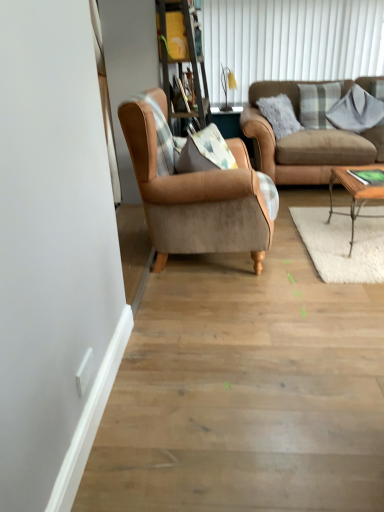
In order to face suede brown armchair at center, should I rotate leftwards or rightwards?

You should rotate right by 2.351 degrees.

In order to click on suede brown armchair at center in this screenshot , I will do coord(196,198).

Measure the distance between point (226, 71) and camera.

The depth of point (226, 71) is 4.35 meters.

Locate an element on the screen. matte yellow lampshade at upper center is located at coordinates (227, 85).

The image size is (384, 512). What do you see at coordinates (317, 103) in the screenshot?
I see `plaid fabric pillow at upper right, acting as the first pillow starting from the left` at bounding box center [317, 103].

This screenshot has height=512, width=384. In order to click on white textured shutter at upper center in this screenshot , I will do `click(290, 41)`.

Identify the location of suede brown armchair at center. This screenshot has height=512, width=384. (196, 198).

Can woodenwoodencoffee table at right be found inside wooden bookshelf at upper center?

No, woodenwoodencoffee table at right is not surrounded by wooden bookshelf at upper center.

From a real-world perspective, is wooden bookshelf at upper center positioned under woodenwoodencoffee table at right based on gravity?

Actually, wooden bookshelf at upper center is physically above woodenwoodencoffee table at right in the real world.

Does wooden bookshelf at upper center have a lesser height compared to woodenwoodencoffee table at right?

No.

Considering their positions, is white plastic power outlet at lower left located in front of or behind wooden bookshelf at upper center?

In the image, white plastic power outlet at lower left appears in front of wooden bookshelf at upper center.

From the image's perspective, is white plastic power outlet at lower left beneath wooden bookshelf at upper center?

Yes, from the image's perspective, white plastic power outlet at lower left is below wooden bookshelf at upper center.

What's the angular difference between white plastic power outlet at lower left and wooden bookshelf at upper center's facing directions?

0.296 degrees separate the facing orientations of white plastic power outlet at lower left and wooden bookshelf at upper center.

Considering the relative sizes of white plastic power outlet at lower left and wooden bookshelf at upper center in the image provided, is white plastic power outlet at lower left wider than wooden bookshelf at upper center?

No, white plastic power outlet at lower left is not wider than wooden bookshelf at upper center.

Considering the positions of point (344, 108) and point (305, 52), is point (344, 108) closer or farther from the camera than point (305, 52)?

Point (344, 108) is closer to the camera than point (305, 52).

Based on their sizes in the image, would you say gray cotton pillow at upper right, the first pillow from the right, is bigger or smaller than white textured shutter at upper center?

In the image, gray cotton pillow at upper right, the first pillow from the right, appears to be smaller than white textured shutter at upper center.

Could you tell me if gray cotton pillow at upper right, which is the 2th pillow from left to right, is turned towards white textured shutter at upper center?

No, gray cotton pillow at upper right, which is the 2th pillow from left to right, is not oriented towards white textured shutter at upper center.

Who is shorter, gray cotton pillow at upper right, which is the 2th pillow from left to right, or white textured shutter at upper center?

gray cotton pillow at upper right, which is the 2th pillow from left to right.

Between wooden bookshelf at upper center and suede brown armchair at center, which one has smaller width?

Thinner between the two is wooden bookshelf at upper center.

Which is nearer, [201,90] or [208,177]?

Clearly, point [201,90] is more distant from the camera than point [208,177].

Is wooden bookshelf at upper center positioned with its back to suede brown armchair at center?

No.

Is white plastic power outlet at lower left taller than gray cotton pillow at upper right, which is the 2th pillow from left to right?

No.

Starting from the white plastic power outlet at lower left, which pillow is the 2nd one to the right? Please provide its 2D coordinates.

[(356, 111)]

From a real-world perspective, who is located higher, white plastic power outlet at lower left or gray cotton pillow at upper right, the first pillow from the right?

gray cotton pillow at upper right, the first pillow from the right, is physically above.

Is white plastic power outlet at lower left oriented towards gray cotton pillow at upper right, the first pillow from the right?

No.

How far apart are gray cotton pillow at upper right, the first pillow from the right, and brown leather couch at upper right?

gray cotton pillow at upper right, the first pillow from the right, and brown leather couch at upper right are 16.49 inches apart from each other.

In the scene shown: From a real-world perspective, which object rests below the other?

brown leather couch at upper right is physically lower.

Can you confirm if gray cotton pillow at upper right, the first pillow from the right, is wider than brown leather couch at upper right?

Incorrect, the width of gray cotton pillow at upper right, the first pillow from the right, does not surpass that of brown leather couch at upper right.

Is gray cotton pillow at upper right, which is the 2th pillow from left to right, inside or outside of brown leather couch at upper right?

gray cotton pillow at upper right, which is the 2th pillow from left to right, is inside brown leather couch at upper right.

Looking at the image, does gray cotton pillow at upper right, which is the 2th pillow from left to right, seem bigger or smaller compared to suede brown armchair at center?

Considering their sizes, gray cotton pillow at upper right, which is the 2th pillow from left to right, takes up less space than suede brown armchair at center.

Is suede brown armchair at center inside gray cotton pillow at upper right, the first pillow from the right?

Actually, suede brown armchair at center is outside gray cotton pillow at upper right, the first pillow from the right.

Can you confirm if gray cotton pillow at upper right, which is the 2th pillow from left to right, is wider than suede brown armchair at center?

No, gray cotton pillow at upper right, which is the 2th pillow from left to right, is not wider than suede brown armchair at center.

Can you confirm if gray cotton pillow at upper right, the first pillow from the right, is positioned to the left of suede brown armchair at center?

Incorrect, gray cotton pillow at upper right, the first pillow from the right, is not on the left side of suede brown armchair at center.

Locate an element on the screen. This screenshot has height=512, width=384. bookshelf above the woodenwoodencoffee table at right (from a real-world perspective) is located at coordinates (182, 54).

The height and width of the screenshot is (512, 384). What are the coordinates of `power outlet below the wooden bookshelf at upper center (from the image's perspective)` in the screenshot? It's located at (84, 372).

Estimate the real-world distances between objects in this image. Which object is further from suede brown armchair at center, wooden bookshelf at upper center or gray cotton pillow at upper right, the first pillow from the right?

Based on the image, gray cotton pillow at upper right, the first pillow from the right, appears to be further to suede brown armchair at center.

When comparing their distances from white plastic power outlet at lower left, does gray cotton pillow at upper right, which is the 2th pillow from left to right, or suede brown armchair at center seem closer?

suede brown armchair at center is closer to white plastic power outlet at lower left.

Estimate the real-world distances between objects in this image. Which object is closer to woodenwoodencoffee table at right, matte yellow lampshade at upper center or gray cotton pillow at upper right, the first pillow from the right?

gray cotton pillow at upper right, the first pillow from the right, lies closer to woodenwoodencoffee table at right than the other object.

Based on their spatial positions, is suede brown armchair at center or gray cotton pillow at upper right, the first pillow from the right, further from plaid fabric pillow at upper right, which is the second pillow in right-to-left order?

Based on the image, suede brown armchair at center appears to be further to plaid fabric pillow at upper right, which is the second pillow in right-to-left order.

Looking at the image, which one is located further to white textured shutter at upper center, woodenwoodencoffee table at right or brown leather couch at upper right?

woodenwoodencoffee table at right is positioned further to the anchor white textured shutter at upper center.

From the picture: Considering their positions, is suede brown armchair at center positioned closer to matte yellow lampshade at upper center than gray cotton pillow at upper right, the first pillow from the right?

gray cotton pillow at upper right, the first pillow from the right.

Which object lies nearer to the anchor point plaid fabric pillow at upper right, acting as the first pillow starting from the left, wooden bookshelf at upper center or matte yellow lampshade at upper center?

Based on the image, matte yellow lampshade at upper center appears to be nearer to plaid fabric pillow at upper right, acting as the first pillow starting from the left.

Which object lies nearer to the anchor point white plastic power outlet at lower left, white textured shutter at upper center or matte yellow lampshade at upper center?

Based on the image, matte yellow lampshade at upper center appears to be nearer to white plastic power outlet at lower left.

What are the coordinates of `coffee table between suede brown armchair at center and matte yellow lampshade at upper center from front to back` in the screenshot? It's located at (357, 189).

This screenshot has height=512, width=384. In order to click on shutter situated between matte yellow lampshade at upper center and gray cotton pillow at upper right, which is the 2th pillow from left to right, from left to right in this screenshot , I will do (x=290, y=41).

Locate an element on the screen. bookshelf positioned between white plastic power outlet at lower left and plaid fabric pillow at upper right, which is the second pillow in right-to-left order, from near to far is located at coordinates (182, 54).

Image resolution: width=384 pixels, height=512 pixels. I want to click on studio couch between woodenwoodencoffee table at right and gray cotton pillow at upper right, which is the 2th pillow from left to right, along the z-axis, so click(304, 142).